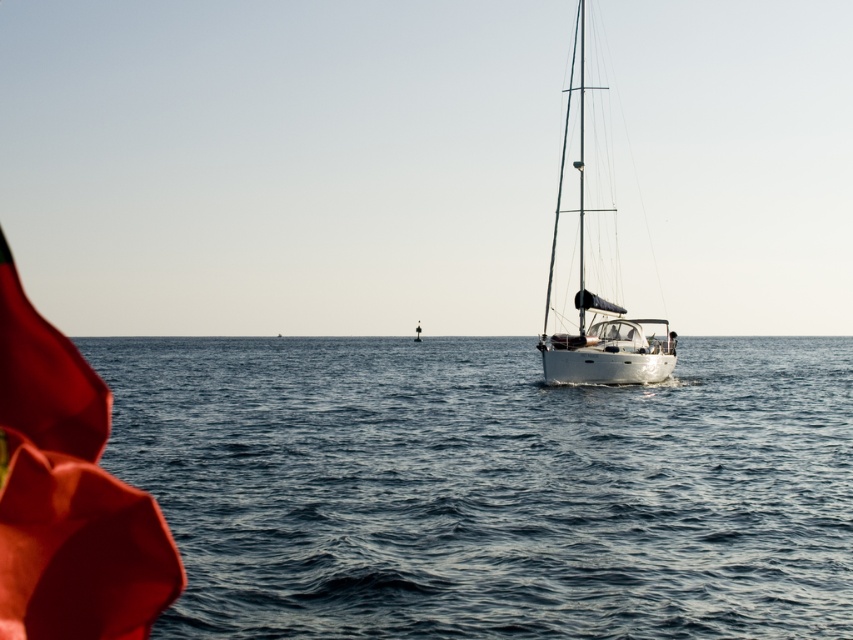
Question: Where is blue water at lower left located in relation to white glossy sailboat at center in the image?

Choices:
 (A) right
 (B) left

Answer: (B)

Question: Which of the following is the farthest from the observer?

Choices:
 (A) pos(585,352)
 (B) pos(381,564)

Answer: (A)

Question: Which point appears closest to the camera in this image?

Choices:
 (A) (280, 371)
 (B) (614, 372)

Answer: (B)

Question: Does blue water at lower left appear on the left side of white glossy sailboat at center?

Choices:
 (A) yes
 (B) no

Answer: (A)

Question: Is the position of blue water at lower left more distant than that of white glossy sailboat at center?

Choices:
 (A) no
 (B) yes

Answer: (A)